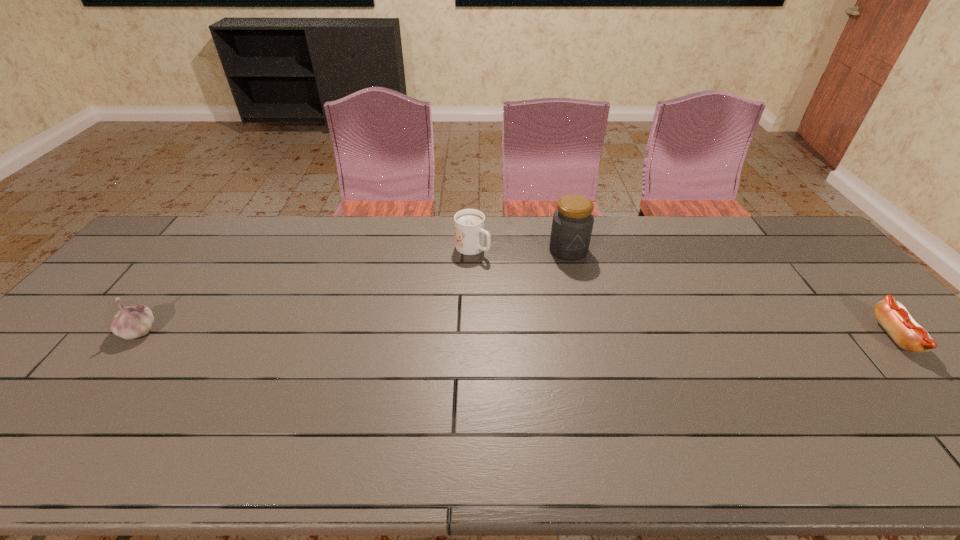
This screenshot has width=960, height=540. Identify the location of vacant space that satisfies the following two spatial constraints: 1. on the back side of the third object from right to left; 2. on the right side of the garlic. [203, 248].